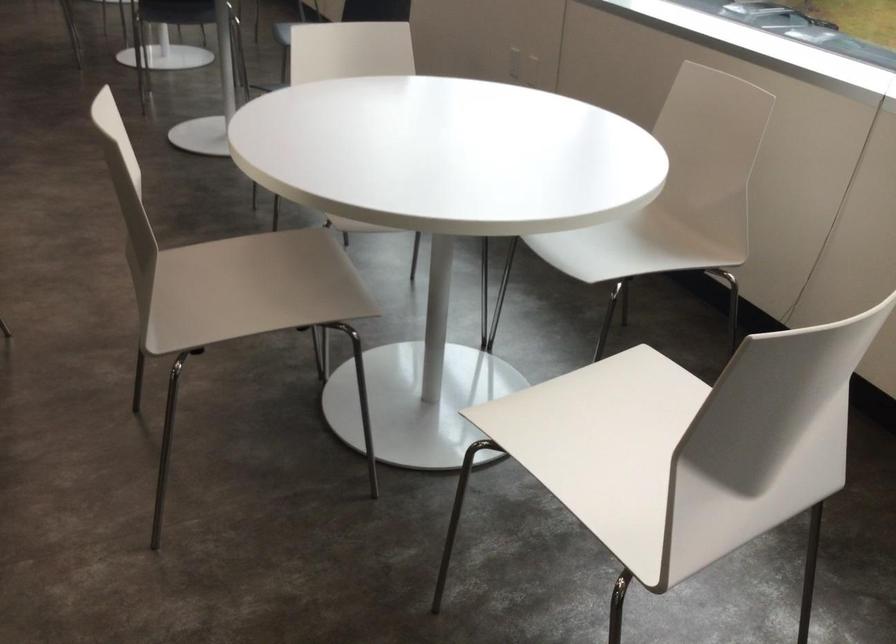
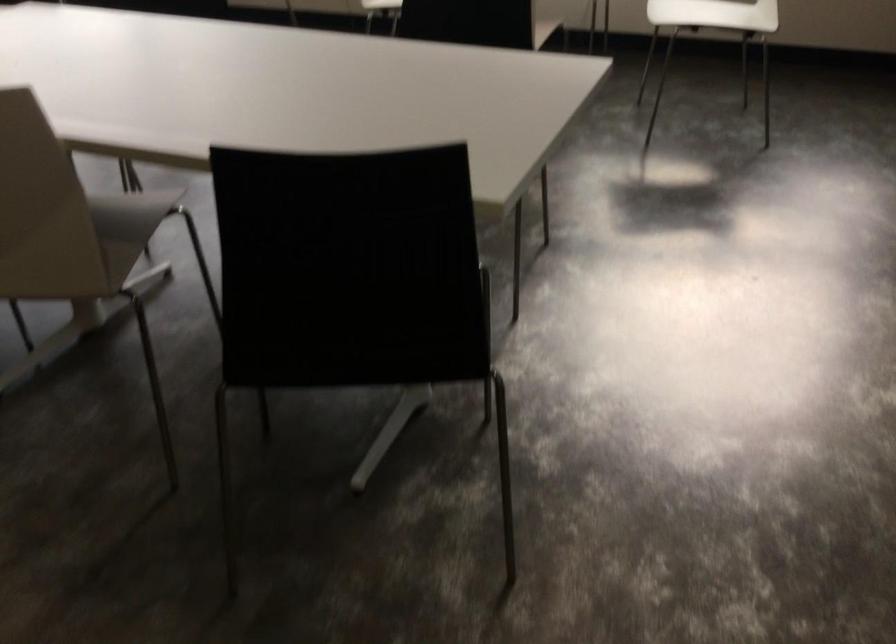
In the second image, find the point that corresponds to point 625,476 in the first image.

(714, 14)